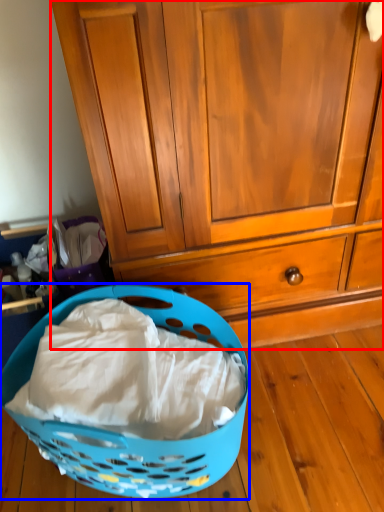
Question: Which of the following is the closest to the observer, cabinetry (highlighted by a red box) or picnic basket (highlighted by a blue box)?

Choices:
 (A) cabinetry
 (B) picnic basket

Answer: (B)